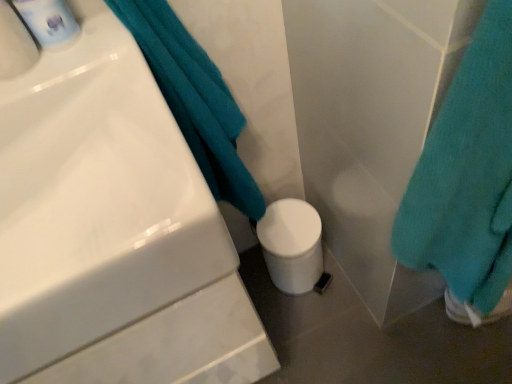
Question: Is teal soft towel at lower right, the 2th bath towel viewed from the left, positioned in front of white glossy mouthwash at upper left?

Choices:
 (A) no
 (B) yes

Answer: (B)

Question: From a real-world perspective, is teal soft towel at lower right, which is counted as the first bath towel, starting from the right, located higher than white glossy mouthwash at upper left?

Choices:
 (A) yes
 (B) no

Answer: (B)

Question: Could you tell me if teal soft towel at lower right, the 2th bath towel viewed from the left, is turned towards white glossy mouthwash at upper left?

Choices:
 (A) yes
 (B) no

Answer: (B)

Question: Is teal soft towel at lower right, the 2th bath towel viewed from the left, facing away from white glossy mouthwash at upper left?

Choices:
 (A) no
 (B) yes

Answer: (A)

Question: Can you confirm if teal soft towel at lower right, the 2th bath towel viewed from the left, is bigger than white glossy mouthwash at upper left?

Choices:
 (A) yes
 (B) no

Answer: (A)

Question: From the image's perspective, is teal soft towel at lower right, the 2th bath towel viewed from the left, located beneath white glossy mouthwash at upper left?

Choices:
 (A) no
 (B) yes

Answer: (B)

Question: From the image's perspective, does teal soft towel at upper left, which appears as the second bath towel when viewed from the right, appear lower than white glossy sink at upper left?

Choices:
 (A) yes
 (B) no

Answer: (B)

Question: Is teal soft towel at upper left, which appears as the second bath towel when viewed from the right, smaller than white glossy sink at upper left?

Choices:
 (A) yes
 (B) no

Answer: (A)

Question: Could you tell me if teal soft towel at upper left, the 1th bath towel positioned from the left, is facing white glossy sink at upper left?

Choices:
 (A) yes
 (B) no

Answer: (B)

Question: Does teal soft towel at upper left, the 1th bath towel positioned from the left, have a larger size compared to white glossy sink at upper left?

Choices:
 (A) yes
 (B) no

Answer: (B)

Question: Does teal soft towel at upper left, which appears as the second bath towel when viewed from the right, have a lesser height compared to white glossy sink at upper left?

Choices:
 (A) yes
 (B) no

Answer: (B)

Question: From a real-world perspective, does teal soft towel at lower right, the 2th bath towel viewed from the left, stand above teal soft towel at upper left, which appears as the second bath towel when viewed from the right?

Choices:
 (A) yes
 (B) no

Answer: (B)